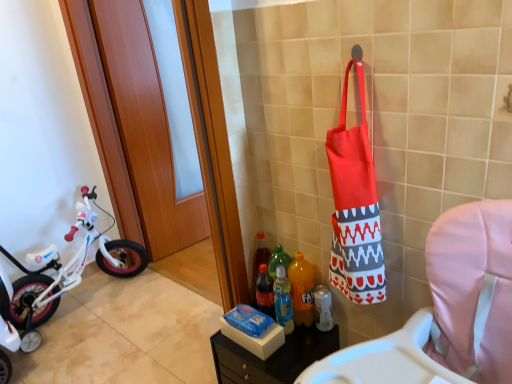
I want to click on vacant space to the right of white matte bicycle at left, so click(157, 320).